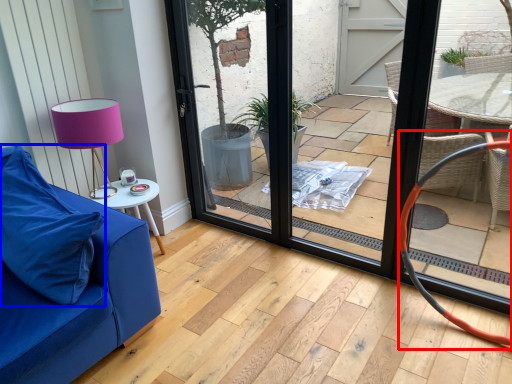
Question: Among these objects, which one is nearest to the camera, armchair (highlighted by a red box) or pillow (highlighted by a blue box)?

Choices:
 (A) armchair
 (B) pillow

Answer: (B)